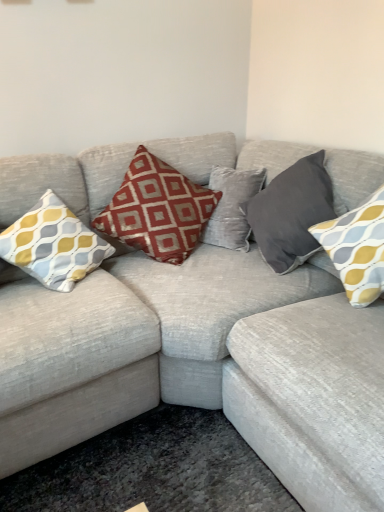
Question: From a real-world perspective, is yellow-grey patterned cushion at left, the 4th pillow viewed from the right, above or below red printed cushion at center, the 3th pillow from the right?

Choices:
 (A) below
 (B) above

Answer: (B)

Question: Is point (56, 250) positioned closer to the camera than point (195, 194)?

Choices:
 (A) farther
 (B) closer

Answer: (B)

Question: Estimate the real-world distances between objects in this image. Which object is closer to the textured gray couch at center?

Choices:
 (A) yellow-grey patterned pillow at right, placed as the 1th pillow when sorted from right to left
 (B) red printed cushion at center, the 3th pillow from the right
 (C) dark gray velvet pillow at upper right, which is the third pillow in left-to-right order
 (D) yellow-grey patterned cushion at left, which ranks as the first pillow in left-to-right order

Answer: (D)

Question: Which object is the farthest from the yellow-grey patterned pillow at right, which is the 4th pillow from left to right?

Choices:
 (A) red printed cushion at center, the 3th pillow from the right
 (B) dark gray velvet pillow at upper right, which is the third pillow in left-to-right order
 (C) textured gray couch at center
 (D) yellow-grey patterned cushion at left, the 4th pillow viewed from the right

Answer: (D)